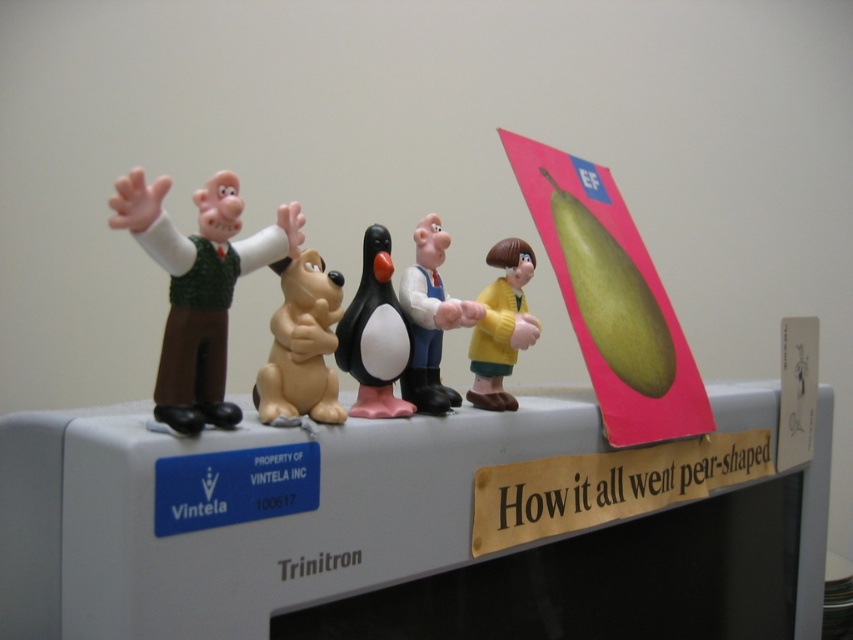
Question: Which object is positioned closest to the tan rubber dog at center?

Choices:
 (A) yellow matte figurine at center
 (B) white plastic figure at center
 (C) black matte penguin at center
 (D) matte green vest at center

Answer: (C)

Question: Does black matte penguin at center have a larger size compared to white plastic figure at center?

Choices:
 (A) yes
 (B) no

Answer: (B)

Question: Which of these objects is positioned closest to the black matte penguin at center?

Choices:
 (A) matte green vest at center
 (B) yellow matte figurine at center

Answer: (B)

Question: Does tan rubber dog at center have a lesser width compared to white plastic figure at center?

Choices:
 (A) yes
 (B) no

Answer: (B)

Question: Is tan rubber dog at center smaller than black matte penguin at center?

Choices:
 (A) no
 (B) yes

Answer: (A)

Question: Which point is farther from the camera taking this photo?

Choices:
 (A) (280, 224)
 (B) (515, 253)

Answer: (B)